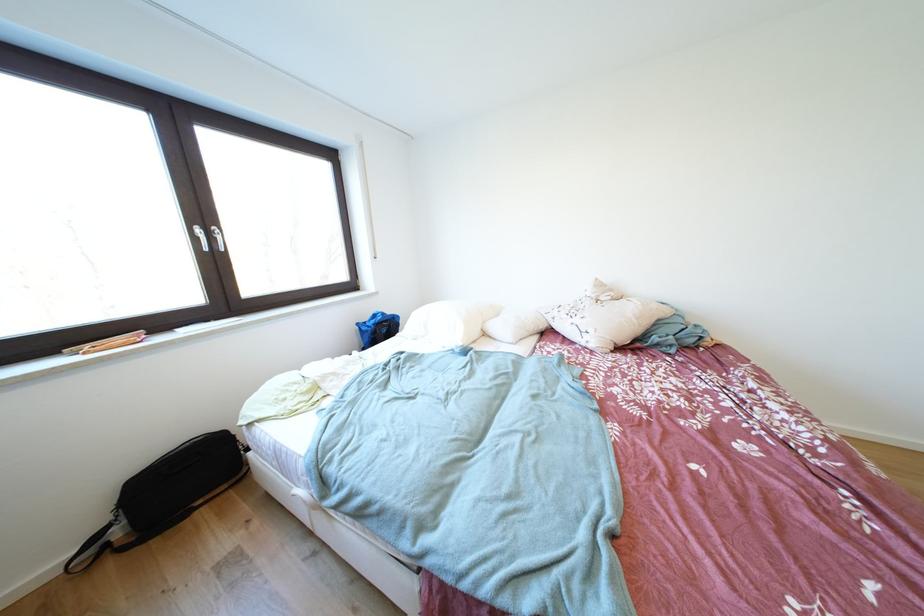
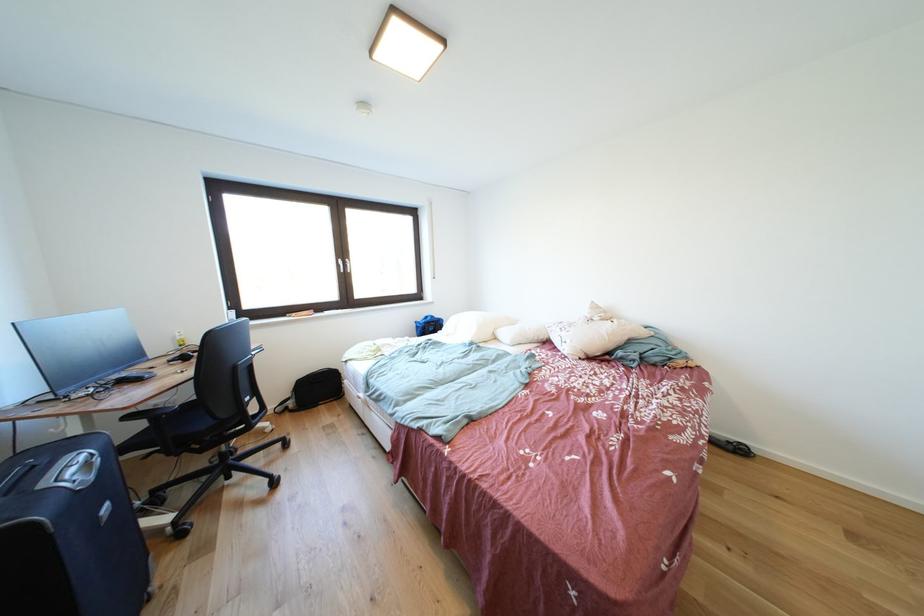
Locate, in the second image, the point that corresponds to pixel 207 235 in the first image.

(348, 265)